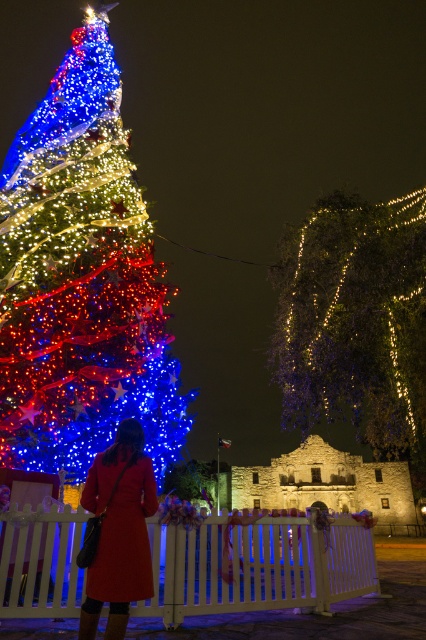
Question: Estimate the real-world distances between objects in this image. Which object is closer to the shiny metallic christmas tree at left?

Choices:
 (A) matte red coat at lower left
 (B) white wooden fence at center

Answer: (A)

Question: Which of the following is the farthest from the observer?

Choices:
 (A) shiny metallic christmas tree at left
 (B) white wooden fence at center

Answer: (A)

Question: Can you confirm if shiny metallic christmas tree at left is bigger than matte red coat at lower left?

Choices:
 (A) yes
 (B) no

Answer: (A)

Question: Which point appears closest to the camera in this image?

Choices:
 (A) (152, 472)
 (B) (173, 609)

Answer: (B)

Question: Is shiny metallic christmas tree at left closer to camera compared to illuminated string lights at upper right?

Choices:
 (A) yes
 (B) no

Answer: (A)

Question: Is shiny metallic christmas tree at left below white wooden fence at center?

Choices:
 (A) no
 (B) yes

Answer: (A)